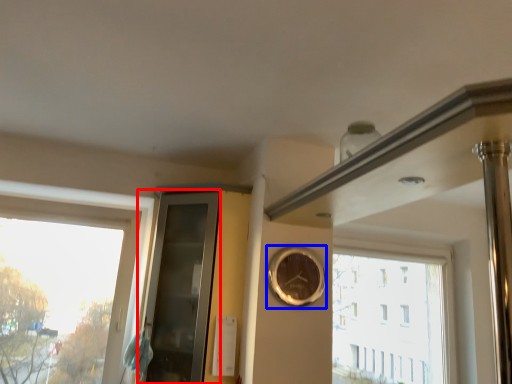
Question: Which of the following is the closest to the observer, glass door (highlighted by a red box) or clock (highlighted by a blue box)?

Choices:
 (A) glass door
 (B) clock

Answer: (A)